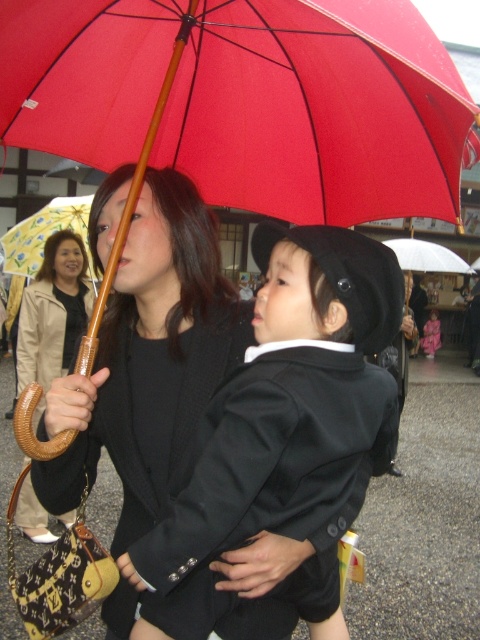
Question: Is matte black umbrella at upper left closer to the viewer compared to yellowmaterial/textureumbrella at upper left?

Choices:
 (A) yes
 (B) no

Answer: (A)

Question: Can you confirm if red fabric umbrella at upper center is positioned below yellowmaterial/textureumbrella at upper left?

Choices:
 (A) no
 (B) yes

Answer: (B)

Question: Among these points, which one is nearest to the camera?

Choices:
 (A) (106, 61)
 (B) (240, 500)
 (C) (36, 244)

Answer: (B)

Question: Which of the following is the farthest from the observer?

Choices:
 (A) (202, 481)
 (B) (1, 246)
 (C) (52, 333)
 (D) (189, 38)

Answer: (B)

Question: Which of the following is the closest to the observer?

Choices:
 (A) pyautogui.click(x=33, y=305)
 (B) pyautogui.click(x=163, y=522)
 (C) pyautogui.click(x=72, y=128)

Answer: (B)

Question: Considering the relative positions of matte black suit at center and matte black umbrella at upper left in the image provided, where is matte black suit at center located with respect to matte black umbrella at upper left?

Choices:
 (A) right
 (B) left

Answer: (A)